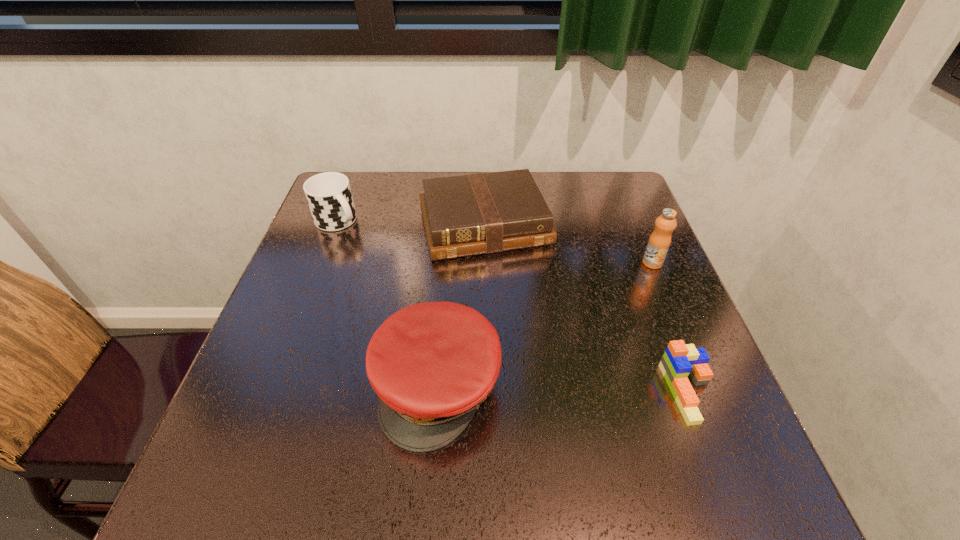
I want to click on vacant space on the desktop that is between the cap and the Lego and is positioned on the front label of the orange juice, so click(x=594, y=390).

The width and height of the screenshot is (960, 540). In order to click on vacant space on the desktop that is between the cap and the Lego and is positioned on the spine side of the Bible in this screenshot , I will do point(543,389).

Identify the location of vacant spot on the desktop that is between the cap and the Lego and is positioned on the side of the cup with the handle. The height and width of the screenshot is (540, 960). (531, 389).